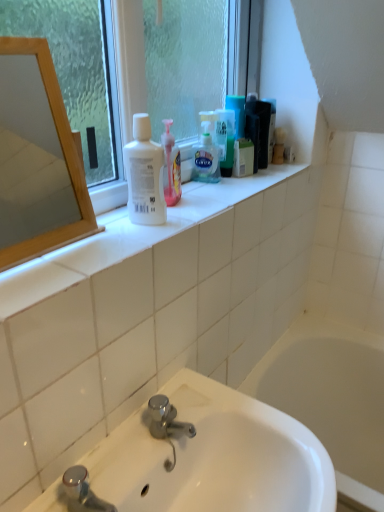
Question: Can you confirm if white glossy sink at lower center is wider than clear glass window at upper center?

Choices:
 (A) no
 (B) yes

Answer: (B)

Question: Is white glossy sink at lower center further to the viewer compared to clear glass window at upper center?

Choices:
 (A) no
 (B) yes

Answer: (A)

Question: From the image's perspective, is white glossy sink at lower center below clear glass window at upper center?

Choices:
 (A) no
 (B) yes

Answer: (B)

Question: Is white glossy sink at lower center shorter than clear glass window at upper center?

Choices:
 (A) yes
 (B) no

Answer: (B)

Question: Is white glossy sink at lower center at the left side of clear glass window at upper center?

Choices:
 (A) no
 (B) yes

Answer: (A)

Question: Considering their positions, is translucent plastic shaving cream at center located in front of or behind white matte bottle at upper center?

Choices:
 (A) behind
 (B) front

Answer: (A)

Question: Do you think translucent plastic shaving cream at center is within white matte bottle at upper center, or outside of it?

Choices:
 (A) inside
 (B) outside

Answer: (B)

Question: From the image's perspective, is translucent plastic shaving cream at center located above or below white matte bottle at upper center?

Choices:
 (A) above
 (B) below

Answer: (A)

Question: Considering the positions of point (203, 160) and point (137, 192), is point (203, 160) closer or farther from the camera than point (137, 192)?

Choices:
 (A) farther
 (B) closer

Answer: (A)

Question: Considering the positions of green matte box at upper center and white glossy sink at lower center in the image, is green matte box at upper center taller or shorter than white glossy sink at lower center?

Choices:
 (A) tall
 (B) short

Answer: (B)

Question: From a real-world perspective, is green matte box at upper center physically located above or below white glossy sink at lower center?

Choices:
 (A) above
 (B) below

Answer: (A)

Question: Considering the positions of green matte box at upper center and white glossy sink at lower center in the image, is green matte box at upper center bigger or smaller than white glossy sink at lower center?

Choices:
 (A) big
 (B) small

Answer: (B)

Question: In terms of width, does green matte box at upper center look wider or thinner when compared to white glossy sink at lower center?

Choices:
 (A) thin
 (B) wide

Answer: (A)

Question: Does point (205, 178) appear closer or farther from the camera than point (29, 143)?

Choices:
 (A) farther
 (B) closer

Answer: (B)

Question: Is translucent plastic shaving cream at center inside the boundaries of wooden mirror at left, or outside?

Choices:
 (A) inside
 (B) outside

Answer: (B)